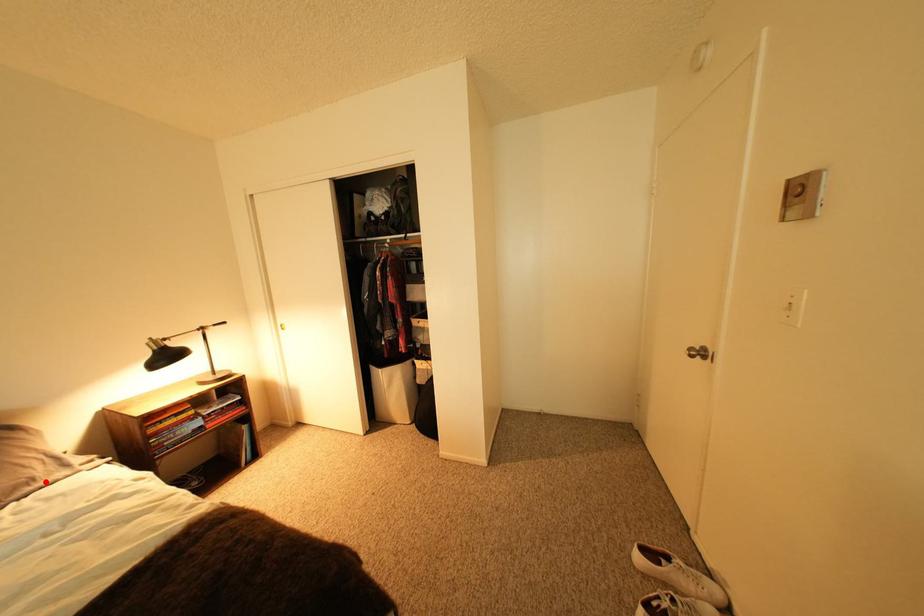
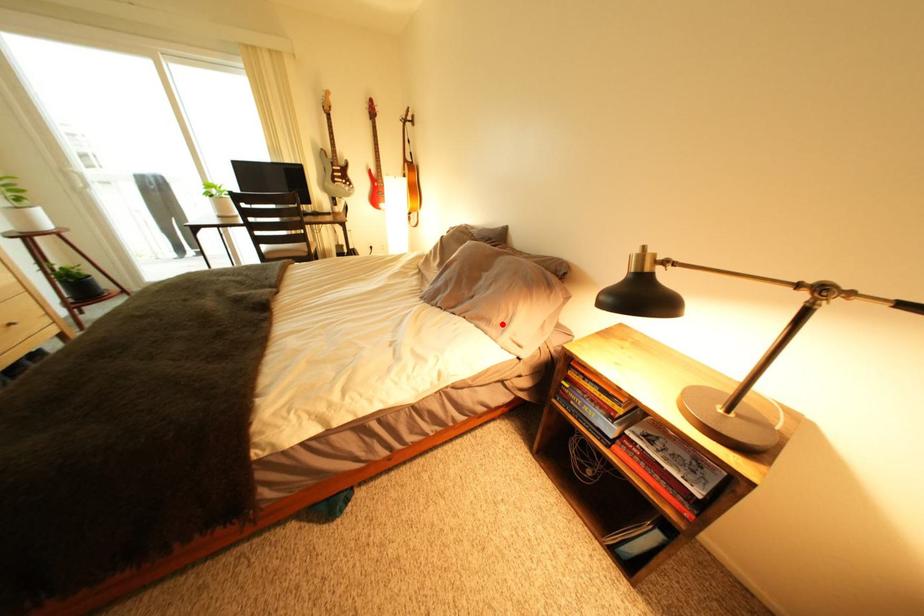
I am providing you with two images of the same scene from different viewpoints. A red point is marked on the first image and another point is marked on the second image. Do the highlighted points in image1 and image2 indicate the same real-world spot?

Yes